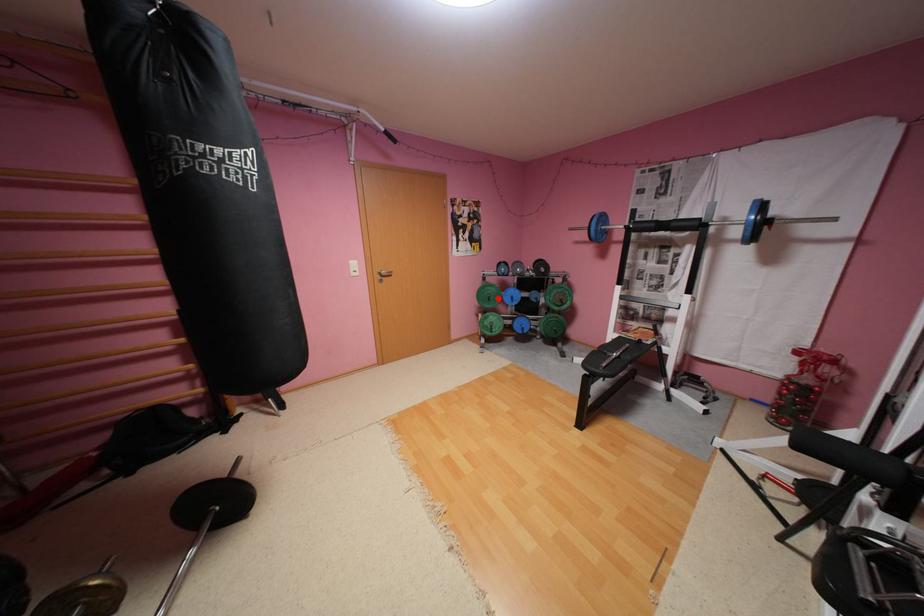
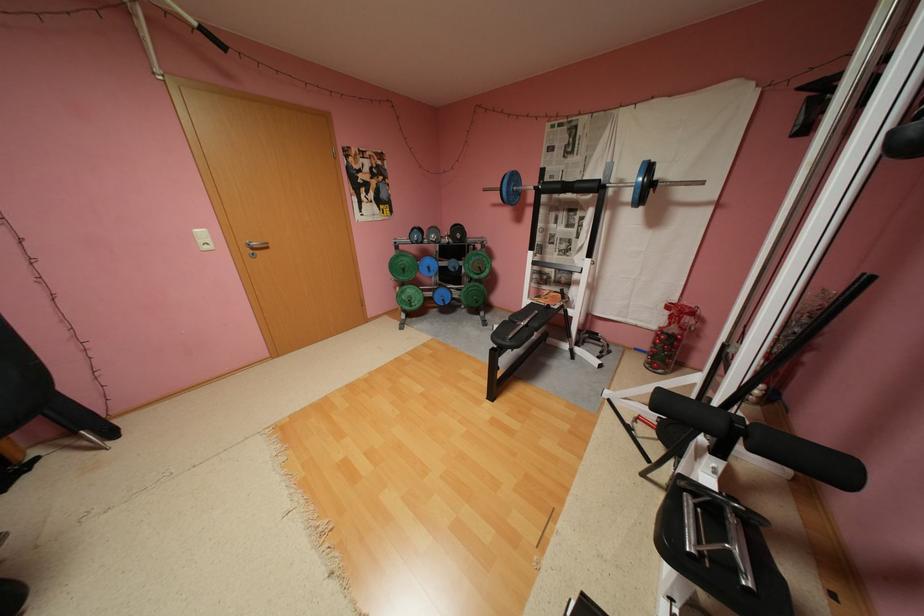
In the second image, find the point that corresponds to the highlighted location in the first image.

(412, 270)